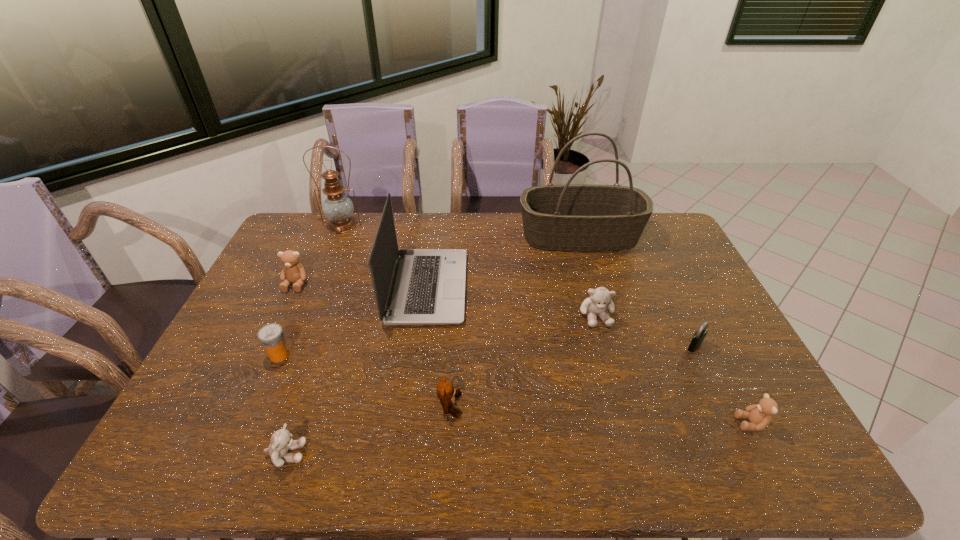
Locate an element on the screen. The image size is (960, 540). object that is the second closest to the nearest object is located at coordinates (446, 393).

Locate which teddy bear ranks fourth in proximity to the black padlock. Please provide its 2D coordinates. Your answer should be formatted as a tuple, i.e. [(x, y)], where the tuple contains the x and y coordinates of a point satisfying the conditions above.

[(281, 442)]

Point out which teddy bear is positioned as the fifth nearest to the black padlock. Please provide its 2D coordinates. Your answer should be formatted as a tuple, i.e. [(x, y)], where the tuple contains the x and y coordinates of a point satisfying the conditions above.

[(292, 272)]

Identify which brown teddy bear is located as the nearest to the leftmost teddy bear. Please provide its 2D coordinates. Your answer should be formatted as a tuple, i.e. [(x, y)], where the tuple contains the x and y coordinates of a point satisfying the conditions above.

[(446, 393)]

This screenshot has height=540, width=960. In order to click on brown teddy bear that stands as the third closest to the oil lamp in this screenshot , I will do `click(759, 415)`.

Where is `vacant region that satisfies the following two spatial constraints: 1. on the front side of the padlock; 2. on the label side of the orange medicine`? vacant region that satisfies the following two spatial constraints: 1. on the front side of the padlock; 2. on the label side of the orange medicine is located at coordinates (699, 355).